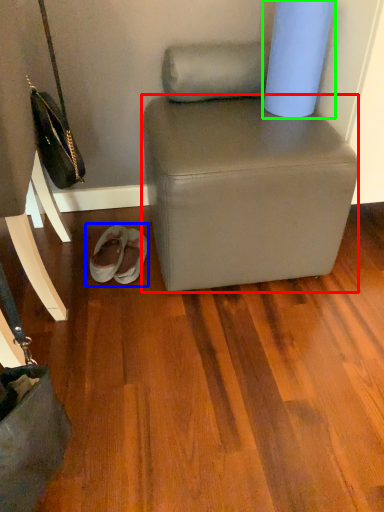
Question: Estimate the real-world distances between objects in this image. Which object is closer to stool (highlighted by a red box), footwear (highlighted by a blue box) or toilet paper (highlighted by a green box)?

Choices:
 (A) footwear
 (B) toilet paper

Answer: (B)